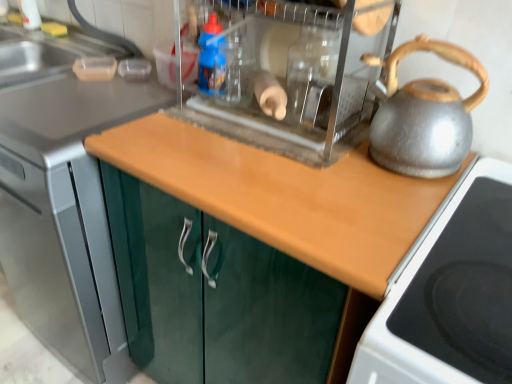
What is the approximate height of matte gray sink at upper left?

It is 5.44 inches.

The height and width of the screenshot is (384, 512). Describe the element at coordinates (285, 196) in the screenshot. I see `wooden at center, placed as the second countertop when sorted from left to right` at that location.

The height and width of the screenshot is (384, 512). Identify the location of silver metallic kettle at right. (425, 116).

Where is `matte gray sink at upper left`? This screenshot has height=384, width=512. matte gray sink at upper left is located at coordinates (45, 54).

In the scene shown: Considering the relative positions of wooden at center, which is the 2th countertop in right-to-left order, and metallic silver kettle at right in the image provided, is wooden at center, which is the 2th countertop in right-to-left order, to the right of metallic silver kettle at right from the viewer's perspective?

No, wooden at center, which is the 2th countertop in right-to-left order, is not to the right of metallic silver kettle at right.

Does wooden at center, placed as the 1th countertop when sorted from left to right, turn towards metallic silver kettle at right?

No, wooden at center, placed as the 1th countertop when sorted from left to right, is not turned towards metallic silver kettle at right.

Are wooden at center, which is the 2th countertop in right-to-left order, and metallic silver kettle at right far apart?

wooden at center, which is the 2th countertop in right-to-left order, is actually quite close to metallic silver kettle at right.

Considering the relative sizes of wooden at center, which is the 2th countertop in right-to-left order, and metallic silver kettle at right in the image provided, is wooden at center, which is the 2th countertop in right-to-left order, taller than metallic silver kettle at right?

Yes.

Which is closer to the camera, (353, 121) or (19, 73)?

The point (353, 121) is closer to the camera.

From the image's perspective, which one is positioned lower, metallic silver kettle at right or matte gray sink at upper left?

metallic silver kettle at right appears lower in the image.

Which object is closer to the camera taking this photo, silver metallic kettle at right or black glass cooktop at right?

black glass cooktop at right is closer to the camera.

Is silver metallic kettle at right oriented towards black glass cooktop at right?

No, silver metallic kettle at right is not facing towards black glass cooktop at right.

Is black glass cooktop at right a part of silver metallic kettle at right?

No.

Who is shorter, silver metallic kettle at right or black glass cooktop at right?

black glass cooktop at right is shorter.

Considering the relative positions of black glass cooktop at right and matte gray sink at upper left in the image provided, is black glass cooktop at right in front of matte gray sink at upper left?

That is True.

Where is `sink lying behind the black glass cooktop at right`? sink lying behind the black glass cooktop at right is located at coordinates (45, 54).

From a real-world perspective, is black glass cooktop at right above or below matte gray sink at upper left?

Clearly, from a real-world perspective, black glass cooktop at right is below matte gray sink at upper left.

Looking at their sizes, would you say black glass cooktop at right is wider or thinner than matte gray sink at upper left?

Clearly, black glass cooktop at right has more width compared to matte gray sink at upper left.

Is matte gray sink at upper left with metallic silver kettle at right?

matte gray sink at upper left and metallic silver kettle at right are clearly separated.

In terms of size, does matte gray sink at upper left appear bigger or smaller than metallic silver kettle at right?

Clearly, matte gray sink at upper left is larger in size than metallic silver kettle at right.

Find the location of a particular element. This screenshot has height=384, width=512. appliance lying below the matte gray sink at upper left (from the image's perspective) is located at coordinates (294, 74).

Which point is more forward, (50, 39) or (368, 47)?

The point (368, 47) is in front.

From the image's perspective, which object appears higher, metallic silver kettle at right or blue plastic bottle at center?

From the image's view, blue plastic bottle at center is above.

What's the angular difference between metallic silver kettle at right and blue plastic bottle at center's facing directions?

0.199 degrees.

Between metallic silver kettle at right and blue plastic bottle at center, which one is positioned in front?

Positioned in front is metallic silver kettle at right.

Can you confirm if wooden at center, placed as the second countertop when sorted from left to right, is smaller than silver metallic kettle at right?

No, wooden at center, placed as the second countertop when sorted from left to right, is not smaller than silver metallic kettle at right.

Is wooden at center, the first countertop when ordered from right to left, positioned far away from silver metallic kettle at right?

Actually, wooden at center, the first countertop when ordered from right to left, and silver metallic kettle at right are a little close together.

How many degrees apart are the facing directions of wooden at center, the first countertop when ordered from right to left, and silver metallic kettle at right?

0.2 degrees.

Is wooden at center, the first countertop when ordered from right to left, aimed at silver metallic kettle at right?

No, wooden at center, the first countertop when ordered from right to left, is not oriented towards silver metallic kettle at right.

Find the location of a particular element. countertop behind the metallic silver kettle at right is located at coordinates (65, 212).

You are a GUI agent. You are given a task and a screenshot of the screen. Output one action in this format:
    pyautogui.click(x=<x>, y=<y>)
    Task: Click on the appliance below the matte gray sink at upper left (from the image's perspective)
    This screenshot has width=512, height=384.
    Given the screenshot: What is the action you would take?
    pyautogui.click(x=294, y=74)

Estimate the real-world distances between objects in this image. Which object is closer to blue plastic bottle at center, wooden at center, which is the 2th countertop in right-to-left order, or wooden at center, placed as the second countertop when sorted from left to right?

The object closer to blue plastic bottle at center is wooden at center, placed as the second countertop when sorted from left to right.

Based on the photo, estimate the real-world distances between objects in this image. Which object is further from wooden at center, placed as the 1th countertop when sorted from left to right, blue plastic bottle at center or matte gray sink at upper left?

blue plastic bottle at center.

Estimate the real-world distances between objects in this image. Which object is further from blue plastic bottle at center, silver metallic kettle at right or wooden at center, which is the 2th countertop in right-to-left order?

Based on the image, wooden at center, which is the 2th countertop in right-to-left order, appears to be further to blue plastic bottle at center.

Considering their positions, is wooden at center, placed as the 1th countertop when sorted from left to right, positioned further to black glass cooktop at right than blue plastic bottle at center?

wooden at center, placed as the 1th countertop when sorted from left to right, is positioned further to the anchor black glass cooktop at right.

Considering their positions, is wooden at center, which is the 2th countertop in right-to-left order, positioned closer to black glass cooktop at right than matte gray sink at upper left?

wooden at center, which is the 2th countertop in right-to-left order.

Estimate the real-world distances between objects in this image. Which object is closer to silver metallic kettle at right, wooden at center, placed as the second countertop when sorted from left to right, or wooden at center, which is the 2th countertop in right-to-left order?

wooden at center, placed as the second countertop when sorted from left to right, is positioned closer to the anchor silver metallic kettle at right.

Consider the image. When comparing their distances from black glass cooktop at right, does metallic silver kettle at right or matte gray sink at upper left seem closer?

Based on the image, metallic silver kettle at right appears to be nearer to black glass cooktop at right.

Based on their spatial positions, is silver metallic kettle at right or metallic silver kettle at right closer to wooden at center, placed as the second countertop when sorted from left to right?

metallic silver kettle at right is closer to wooden at center, placed as the second countertop when sorted from left to right.

Where is `bottle between matte gray sink at upper left and metallic silver kettle at right`? bottle between matte gray sink at upper left and metallic silver kettle at right is located at coordinates (212, 59).

Identify the location of countertop located between wooden at center, placed as the 1th countertop when sorted from left to right, and black glass cooktop at right in the left-right direction. The height and width of the screenshot is (384, 512). (285, 196).

The image size is (512, 384). I want to click on gas stove between silver metallic kettle at right and wooden at center, the first countertop when ordered from right to left, from top to bottom, so click(451, 295).

Locate an element on the screen. This screenshot has width=512, height=384. appliance situated between matte gray sink at upper left and black glass cooktop at right from left to right is located at coordinates (294, 74).